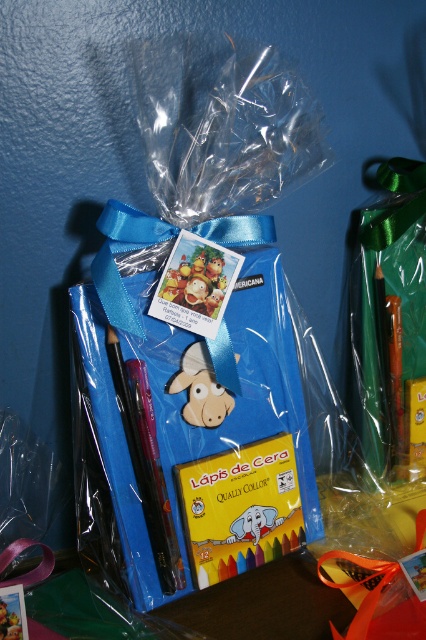
You are organizing a childrens party and have a gift box with two items inside. The items are a wooden donkey at center and a matte plastic toy at center. You need to arrange them side by side on a shelf. Which item should you place on the left to match the original arrangement?

To match the original arrangement, place the matte plastic toy at center on the left and the wooden donkey at center on the right, since the wooden donkey at center is to the right of the matte plastic toy at center in the original image.

You are packing a gift box and need to place the wooden donkey at center and the matte plastic toy at center inside. The box has a width of 5 inches. Can both items fit side by side without overlapping?

The distance between the wooden donkey at center and matte plastic toy at center is 4.54 inches. Since the box is 5 inches wide, there is enough space to fit both items side by side without overlapping.

You are a child who just received a gift and you see the wooden donkey at center and the matte plastic toy at center. Which one is lower in the image?

The wooden donkey at center is located below the matte plastic toy at center, so it is lower in the image.